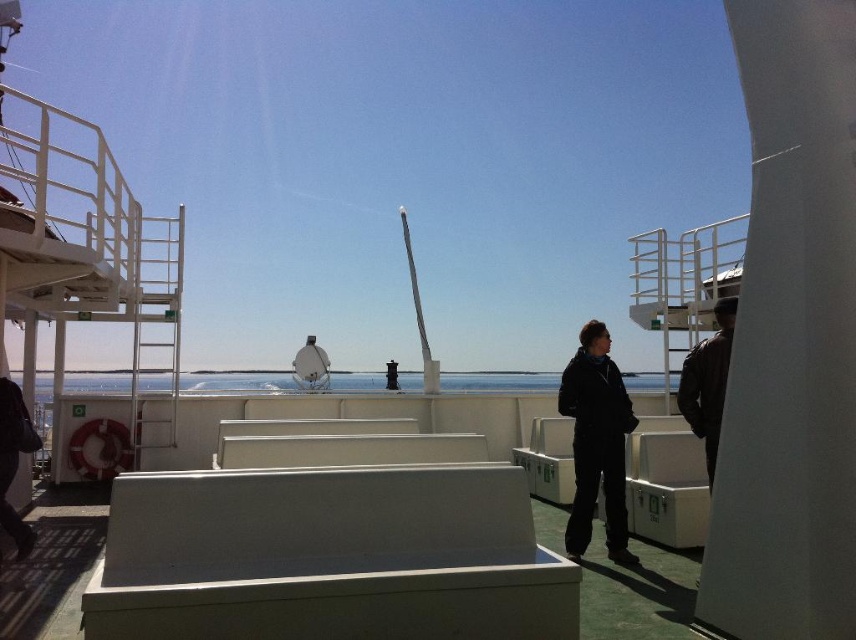
You are standing on the ferry deck and see the black matte jacket at center. If you walk straight ahead from your current position, will you reach the ladder leading up to the raised platform on the left side before encountering any obstacles?

The black matte jacket at center is located at point (596, 442). Since the ladder is on the left side of the image, walking straight ahead would not lead you directly toward the ladder. You would likely encounter other objects or structures before reaching the ladder, such as the white benches arranged in rows on the deck.

You are standing on the ferry deck and want to know which point is closer to you. The points are point (x=587, y=404) and point (x=682, y=408). Which one is closer?

Point (x=682, y=408) is closer to you because it is less further to the camera than point (x=587, y=404).

You are a passenger on the ferry and want to sit on the white benches. You notice two jackets, the black matte jacket at center and the dark brown leather jacket at right. Which jacket is closer to the ground?

The black matte jacket at center is closer to the ground because it is below the dark brown leather jacket at right.